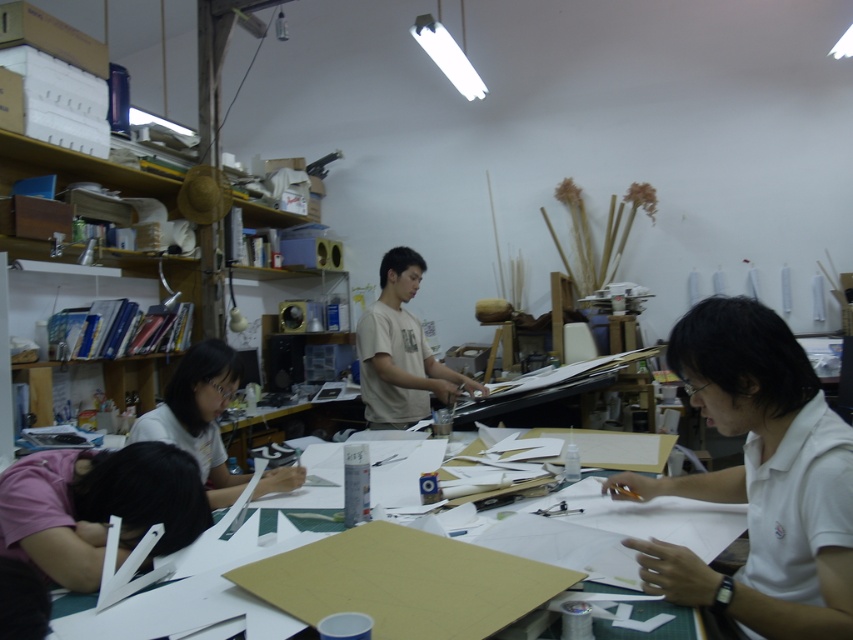
You are standing in the workspace and notice a point at coordinates (x=759, y=477). Which object from the scene is located at that point?

The point at coordinates (x=759, y=477) corresponds to the white matte shirt at lower right.